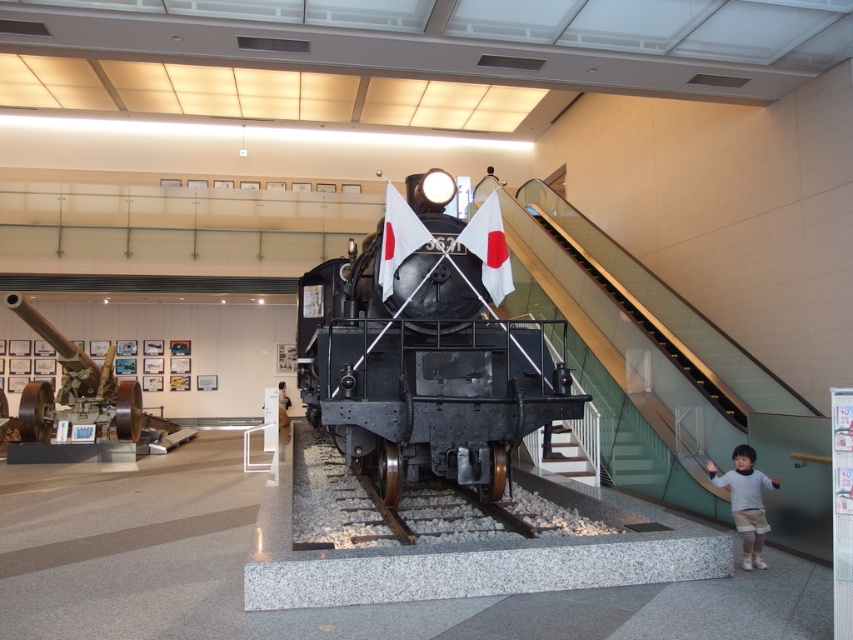
You are a visitor in the museum and want to take the stairs to the upper floor. The clear glass stairs at center and the metallic stair at center are both available. Which one do you think is wider and safer for carrying a large poster?

The clear glass stairs at center is wider than the metallic stair at center, so it is safer for carrying a large poster.

You are standing in the museum and want to take a closer look at the polished black locomotive at center. If you walk straight towards it, how far will you have to walk to reach it?

The polished black locomotive at center is 5.12 meters away from the viewer, so you will have to walk 5.12 meters to reach it.

You are standing in the museum and see the point marked at coordinates (422,360). Which object is this point located on?

The point marked at coordinates (422,360) is located on the polished black locomotive at center.